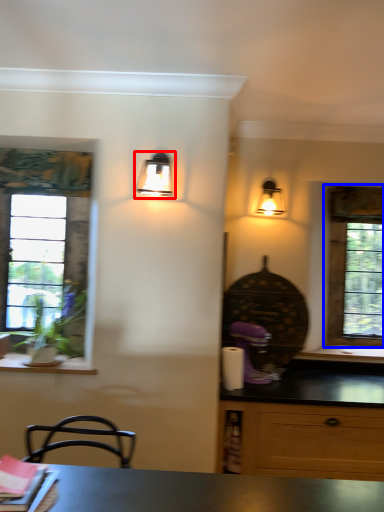
Question: Which object is further to the camera taking this photo, lamp (highlighted by a red box) or window (highlighted by a blue box)?

Choices:
 (A) lamp
 (B) window

Answer: (B)